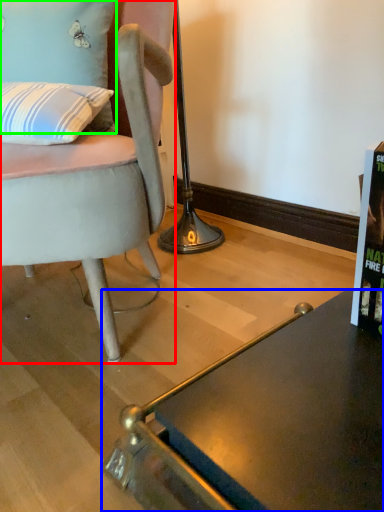
Question: Which is nearer to the chair (highlighted by a red box)? desk (highlighted by a blue box) or pillow (highlighted by a green box).

Choices:
 (A) desk
 (B) pillow

Answer: (B)